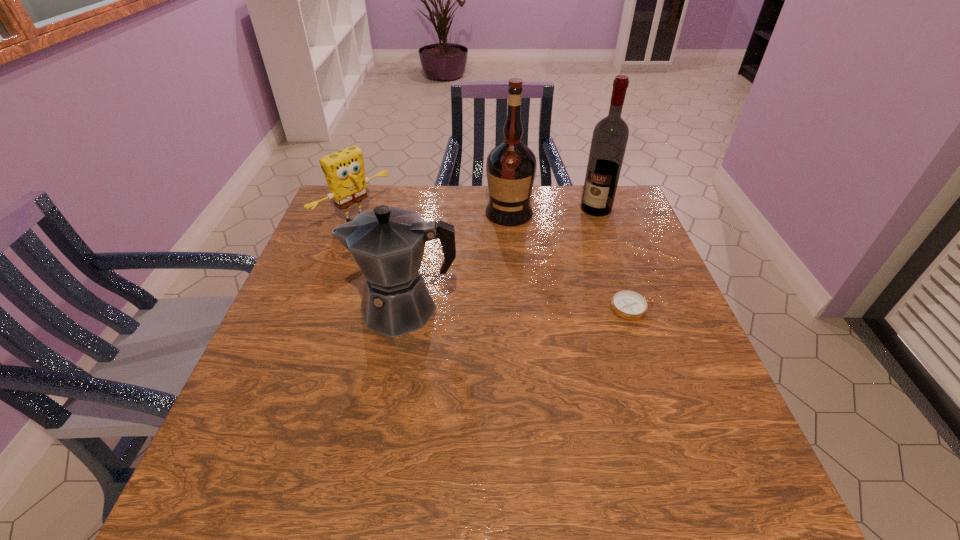
Locate an element on the screen. Image resolution: width=960 pixels, height=540 pixels. sponge present at the far edge is located at coordinates (344, 171).

The width and height of the screenshot is (960, 540). What are the coordinates of `object present at the left edge` in the screenshot? It's located at (344, 171).

Where is `compass situated at the right edge`? The width and height of the screenshot is (960, 540). compass situated at the right edge is located at coordinates (627, 304).

Locate an element on the screen. This screenshot has height=540, width=960. alcohol that is at the right edge is located at coordinates (609, 140).

Locate an element on the screen. object that is positioned at the far left corner is located at coordinates coord(344,171).

Image resolution: width=960 pixels, height=540 pixels. I want to click on object present at the far right corner, so 609,140.

The height and width of the screenshot is (540, 960). In the image, there is a desktop. Identify the location of vacant space at the far edge. (482, 202).

At what (x,y) coordinates should I click in order to perform the action: click on free spot at the near edge of the desktop. Please return your answer as a coordinate pair (x, y). The image size is (960, 540). Looking at the image, I should click on (479, 433).

Where is `vacant space at the left edge`? The width and height of the screenshot is (960, 540). vacant space at the left edge is located at coordinates (286, 295).

Locate an element on the screen. The image size is (960, 540). free region at the right edge of the desktop is located at coordinates (698, 375).